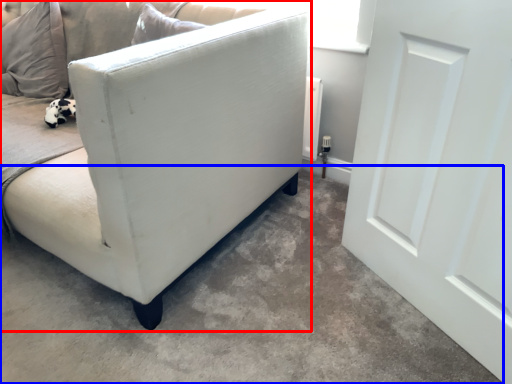
Question: Which of the following is the farthest to the observer, studio couch (highlighted by a red box) or concrete (highlighted by a blue box)?

Choices:
 (A) studio couch
 (B) concrete

Answer: (A)